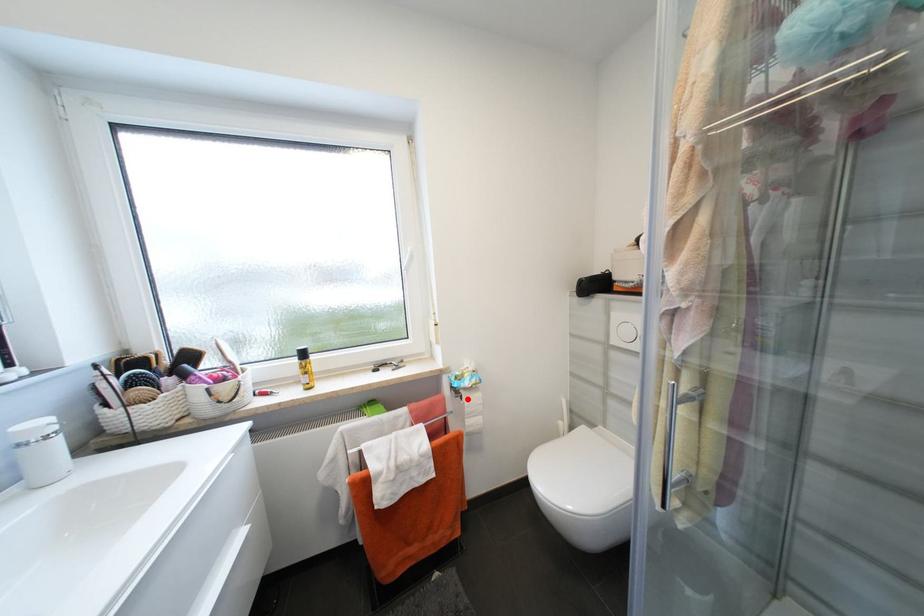
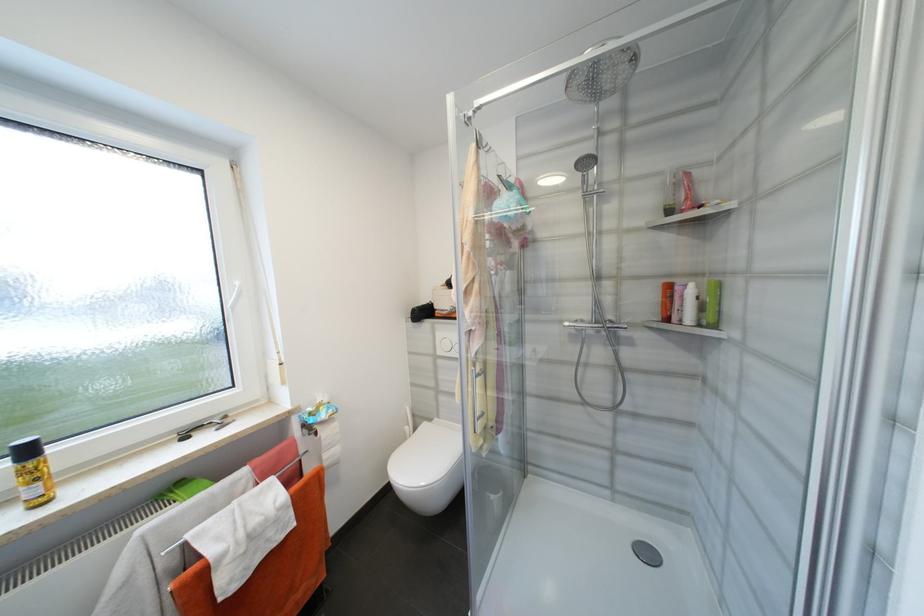
The point at the highlighted location is marked in the first image. Where is the corresponding point in the second image?

(322, 435)